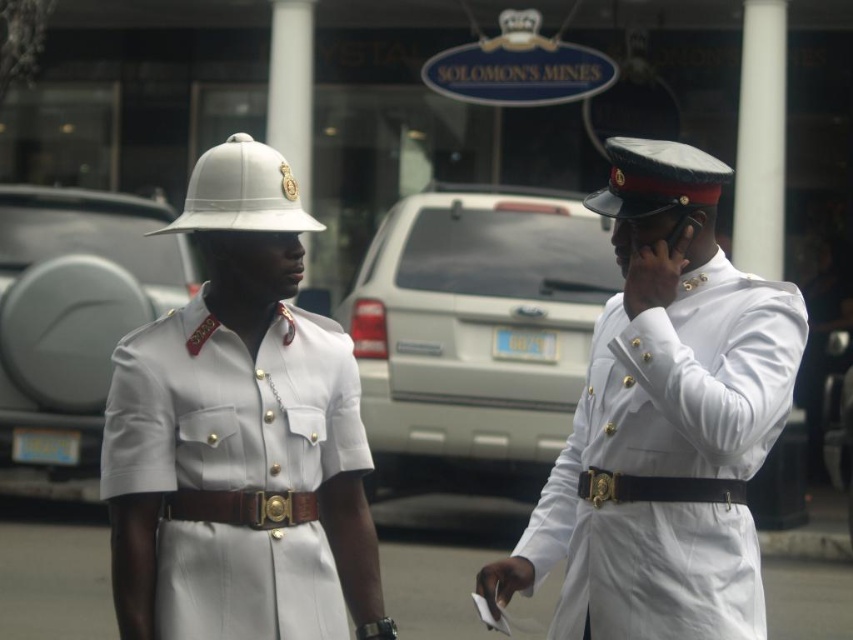
You are a tailor observing two items in the image. You need to determine which item is bigger between the white glossy uniform at right and the black leather belt at center. Which one is larger?

The white glossy uniform at right is larger than the black leather belt at center according to the description.

From the picture: You are a photographer trying to capture the perfect shot of the scene described. You notice a specific point in the image at coordinates (236,467). Which object in the scene is located at this point?

The point at coordinates (236,467) corresponds to the white glossy uniform at center.

In the scene shown: You are a photographer trying to capture the white glossy uniform at center in the image. The camera you are using has a fixed focus point at coordinate point (236, 467). Will the focus point be positioned correctly to capture the white glossy uniform at center?

Yes, the focus point at point (236, 467) is exactly where the white glossy uniform at center is located, so it will be correctly focused.